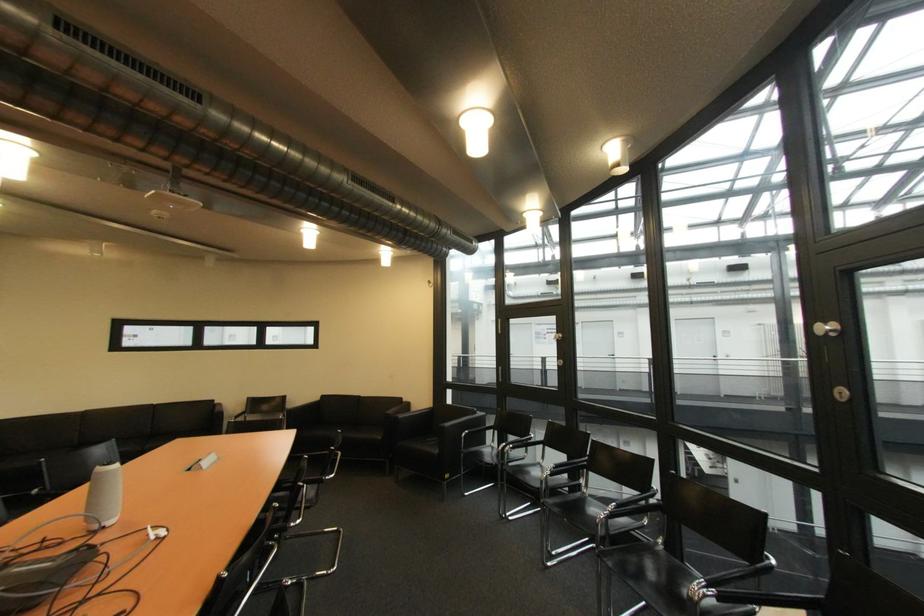
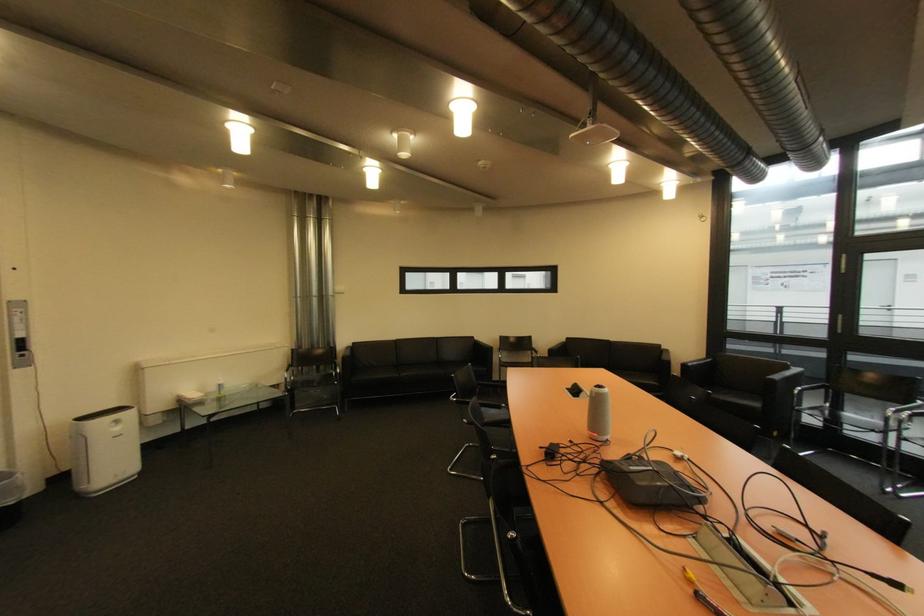
Locate, in the second image, the point that corresponds to point (475, 432) in the first image.

(808, 390)